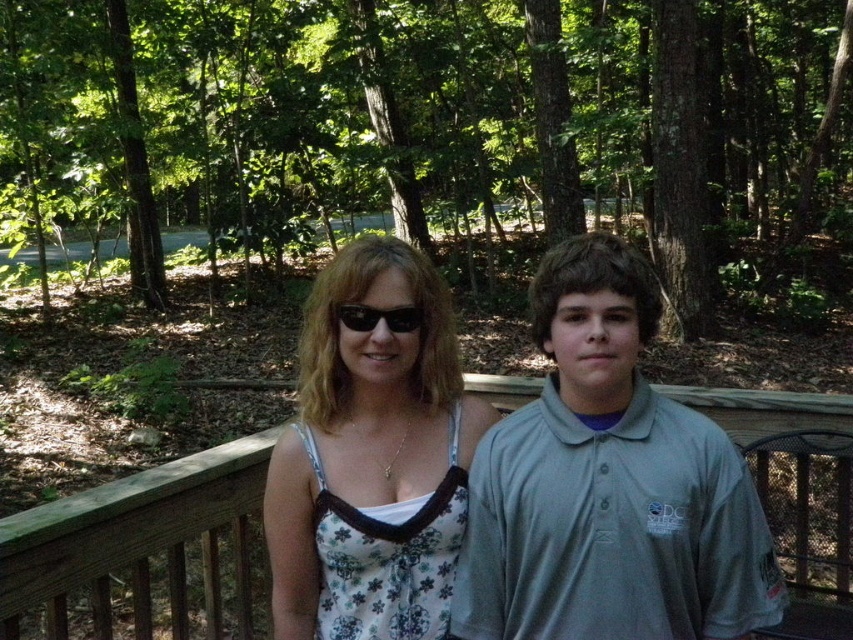
You are a photographer setting up for a photoshoot in a forest. You have two outfits to choose from for the model to wear. The outfits are the gray cotton polo shirt at center and the white floral dress at center. Based on their sizes, which outfit would be more appropriate if you want the model to appear taller in the photo?

The white floral dress at center is taller than the gray cotton polo shirt at center, so choosing the white floral dress at center would make the model appear taller in the photo.

You are trying to decide which item to pick up first from the ground where both the gray cotton polo shirt at center and the black plastic sunglasses at center are lying. Based on their sizes, which one should you pick up first?

The gray cotton polo shirt at center is bigger than the black plastic sunglasses at center, so you should pick up the gray cotton polo shirt at center first since it takes up more space on the ground.

You are a photographer setting up a shot of the two people in the scene. You want to ensure both the white floral dress at center and the black plastic sunglasses at center are clearly visible. Given their sizes, which object should you focus on to ensure proper framing?

The white floral dress at center is wider than the black plastic sunglasses at center, so focusing on the dress will help ensure proper framing as it takes up more space in the composition.